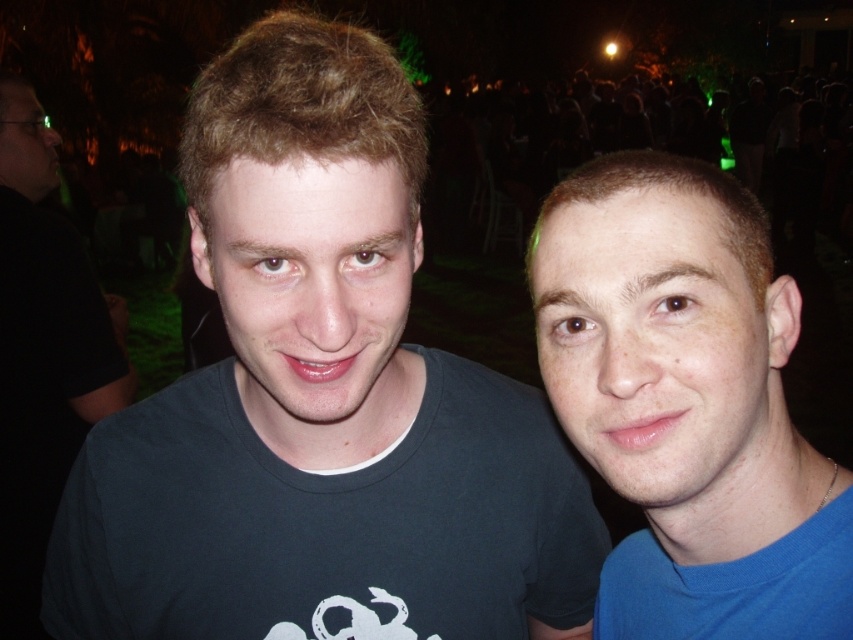
Does dark blue t-shirt at center appear over blue matte shirt at right?

Yes.

Between dark blue t-shirt at center and blue matte shirt at right, which one appears on the left side from the viewer's perspective?

dark blue t-shirt at center is more to the left.

Where is `dark blue t-shirt at center`? Image resolution: width=853 pixels, height=640 pixels. dark blue t-shirt at center is located at coordinates (318, 401).

Find the location of a particular element. The image size is (853, 640). dark blue t-shirt at center is located at coordinates (318, 401).

Does dark blue t-shirt at center have a greater height compared to black matte t-shirt at left?

No.

The height and width of the screenshot is (640, 853). What are the coordinates of `dark blue t-shirt at center` in the screenshot? It's located at (318, 401).

You are a GUI agent. You are given a task and a screenshot of the screen. Output one action in this format:
    pyautogui.click(x=<x>, y=<y>)
    Task: Click on the dark blue t-shirt at center
    
    Given the screenshot: What is the action you would take?
    pyautogui.click(x=318, y=401)

Is point (614, 474) positioned before point (113, 388)?

Yes, point (614, 474) is in front of point (113, 388).

Who is more distant from viewer, (665, 628) or (55, 248)?

Positioned behind is point (55, 248).

This screenshot has height=640, width=853. I want to click on blue matte shirt at right, so click(688, 403).